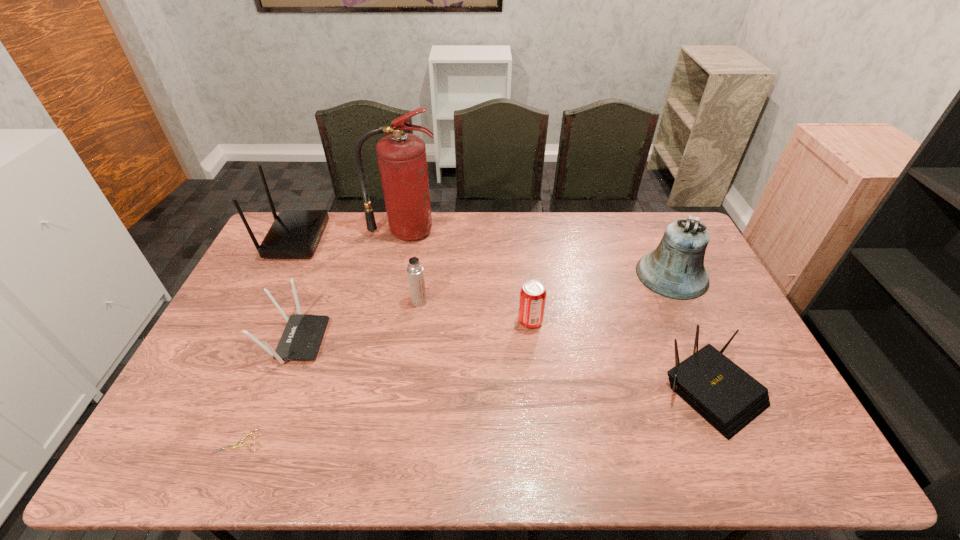
This screenshot has width=960, height=540. I want to click on free space between the fire extinguisher and the third object from right to left, so click(468, 276).

Select which object is the third closest to the thermos bottle. Please provide its 2D coordinates. Your answer should be formatted as a tuple, i.e. [(x, y)], where the tuple contains the x and y coordinates of a point satisfying the conditions above.

[(532, 300)]

Identify which object is located as the fourth nearest to the tallest object. Please provide its 2D coordinates. Your answer should be formatted as a tuple, i.e. [(x, y)], where the tuple contains the x and y coordinates of a point satisfying the conditions above.

[(532, 300)]

This screenshot has height=540, width=960. Find the location of `router that is the closest one to the farthest router`. router that is the closest one to the farthest router is located at coordinates (301, 339).

I want to click on router that is the closest to the soda, so click(726, 396).

Find the location of a particular element. The width and height of the screenshot is (960, 540). free location that satisfies the following two spatial constraints: 1. at the front of the shortest router where the nozzle is aimed; 2. on the left side of the fire extinguisher is located at coordinates (371, 392).

This screenshot has width=960, height=540. Identify the location of vacant region that satisfies the following two spatial constraints: 1. on the back side of the fourth tallest object; 2. on the front-facing side of the farthest router. (428, 239).

This screenshot has width=960, height=540. I want to click on free point that satisfies the following two spatial constraints: 1. at the front of the tallest object where the nozzle is aimed; 2. on the right side of the sixth object from left to right, so click(x=386, y=321).

You are a GUI agent. You are given a task and a screenshot of the screen. Output one action in this format:
    pyautogui.click(x=<x>, y=<y>)
    Task: Click on the free space that satisfies the following two spatial constraints: 1. on the back side of the fourth tallest object; 2. on the right side of the bell
    
    Given the screenshot: What is the action you would take?
    pyautogui.click(x=423, y=275)

Find the location of a particular element. This screenshot has width=960, height=540. vacant area in the image that satisfies the following two spatial constraints: 1. on the back side of the rightmost router; 2. on the front-facing side of the second shortest router is located at coordinates (689, 340).